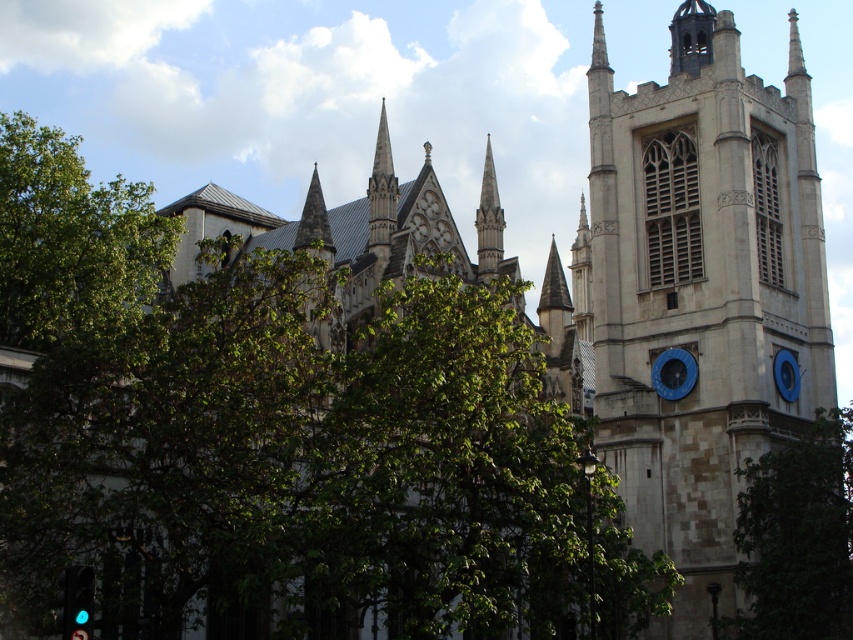
Is green leafy tree at right thinner than blue metallic clock at upper right?

No, green leafy tree at right is not thinner than blue metallic clock at upper right.

Find the location of a particular element. This screenshot has height=640, width=853. green leafy tree at right is located at coordinates (798, 538).

Is green leafy tree at right bigger than green glass traffic light at lower left?

Yes, green leafy tree at right is bigger than green glass traffic light at lower left.

Between point (781, 504) and point (67, 580), which one is positioned behind?

The point (781, 504) is more distant.

At what (x,y) coordinates should I click in order to perform the action: click on green leafy tree at right. Please return your answer as a coordinate pair (x, y). Looking at the image, I should click on (798, 538).

Does stone clock tower at upper right have a lesser height compared to blue metallic clock at upper right?

No.

Does point (683, 170) come behind point (787, 396)?

That is True.

Where is `stone clock tower at upper right`? The image size is (853, 640). stone clock tower at upper right is located at coordinates (700, 289).